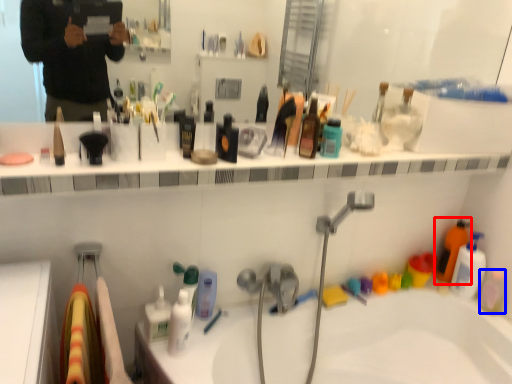
Question: Which of the following is the farthest to the observer, cleaning product (highlighted by a red box) or mouthwash (highlighted by a blue box)?

Choices:
 (A) cleaning product
 (B) mouthwash

Answer: (A)